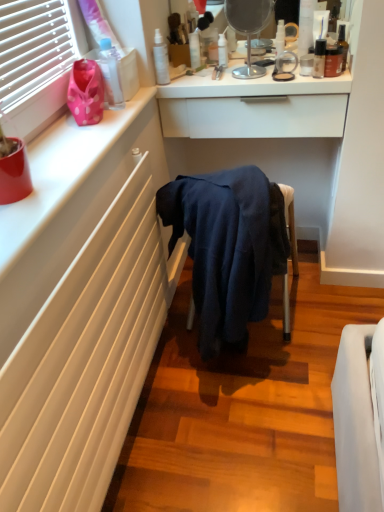
The image size is (384, 512). I want to click on free space to the left of metallic silver mirror at upper center, so click(x=203, y=79).